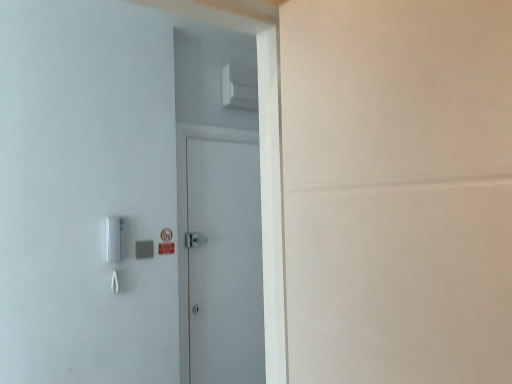
Based on the photo, measure the distance between point (145, 244) and camera.

The depth of point (145, 244) is 2.20 meters.

The width and height of the screenshot is (512, 384). Identify the location of gray matte/light switch at left. (144, 249).

Describe the element at coordinates (144, 249) in the screenshot. I see `gray matte/light switch at left` at that location.

What is the approximate width of white matte door at center?

white matte door at center is 5.38 centimeters in width.

You are a GUI agent. You are given a task and a screenshot of the screen. Output one action in this format:
    pyautogui.click(x=<x>, y=<y>)
    Task: Click on the white matte door at center
    Image resolution: width=512 pixels, height=384 pixels.
    Given the screenshot: What is the action you would take?
    pyautogui.click(x=225, y=263)

What do you see at coordinates (225, 263) in the screenshot? The width and height of the screenshot is (512, 384). I see `white matte door at center` at bounding box center [225, 263].

Identify the location of gray matte/light switch at left. (144, 249).

Which is more to the left, white matte door at center or gray matte/light switch at left?

gray matte/light switch at left is more to the left.

Is the position of white matte door at center more distant than that of gray matte/light switch at left?

Yes, white matte door at center is behind gray matte/light switch at left.

Is point (191, 208) less distant than point (152, 250)?

That is False.

From the image's perspective, which object appears higher, white matte door at center or gray matte/light switch at left?

gray matte/light switch at left is shown above in the image.

From a real-world perspective, is white matte door at center above or below gray matte/light switch at left?

white matte door at center is below gray matte/light switch at left.

Which of these two, white matte door at center or gray matte/light switch at left, is wider?

Wider between the two is white matte door at center.

Is white matte door at center shorter than gray matte/light switch at left?

Incorrect, the height of white matte door at center does not fall short of that of gray matte/light switch at left.

Is white matte door at center bigger than gray matte/light switch at left?

Yes, white matte door at center is bigger than gray matte/light switch at left.

Is white matte door at center situated inside gray matte/light switch at left or outside?

white matte door at center is not enclosed by gray matte/light switch at left.

Are white matte door at center and gray matte/light switch at left located far from each other?

They are positioned close to each other.

Is gray matte/light switch at left at the back of white matte door at center?

white matte door at center does not have its back to gray matte/light switch at left.

How many degrees apart are the facing directions of white matte door at center and gray matte/light switch at left?

0.208 degrees separate the facing orientations of white matte door at center and gray matte/light switch at left.

Image resolution: width=512 pixels, height=384 pixels. What are the coordinates of `door below the gray matte/light switch at left (from the image's perspective)` in the screenshot? It's located at (225, 263).

Which is more to the left, gray matte/light switch at left or white matte door at center?

gray matte/light switch at left is more to the left.

In the image, is gray matte/light switch at left positioned in front of or behind white matte door at center?

gray matte/light switch at left is positioned closer to the viewer than white matte door at center.

Which is in front, point (152, 244) or point (214, 274)?

The point (152, 244) is closer to the camera.

From the image's perspective, between gray matte/light switch at left and white matte door at center, who is located below?

white matte door at center.

From a real-world perspective, between gray matte/light switch at left and white matte door at center, who is vertically higher?

gray matte/light switch at left.

Between gray matte/light switch at left and white matte door at center, which one has larger width?

white matte door at center is wider.

Considering the relative sizes of gray matte/light switch at left and white matte door at center in the image provided, is gray matte/light switch at left shorter than white matte door at center?

Yes.

Considering the sizes of objects gray matte/light switch at left and white matte door at center in the image provided, who is smaller, gray matte/light switch at left or white matte door at center?

Smaller between the two is gray matte/light switch at left.

Would you say gray matte/light switch at left is inside or outside white matte door at center?

The correct answer is: outside.

Is gray matte/light switch at left far from white matte door at center?

No, gray matte/light switch at left is not far away from white matte door at center.

Is gray matte/light switch at left oriented away from white matte door at center?

No, white matte door at center is not at the back of gray matte/light switch at left.

How many degrees apart are the facing directions of gray matte/light switch at left and white matte door at center?

gray matte/light switch at left and white matte door at center are facing 0.208 degrees away from each other.

Where is `light switch that appears above the white matte door at center (from a real-world perspective)`? This screenshot has width=512, height=384. light switch that appears above the white matte door at center (from a real-world perspective) is located at coordinates (144, 249).

The width and height of the screenshot is (512, 384). I want to click on door that is below the gray matte/light switch at left (from the image's perspective), so click(225, 263).

Identify the location of door on the right of gray matte/light switch at left. The image size is (512, 384). (225, 263).